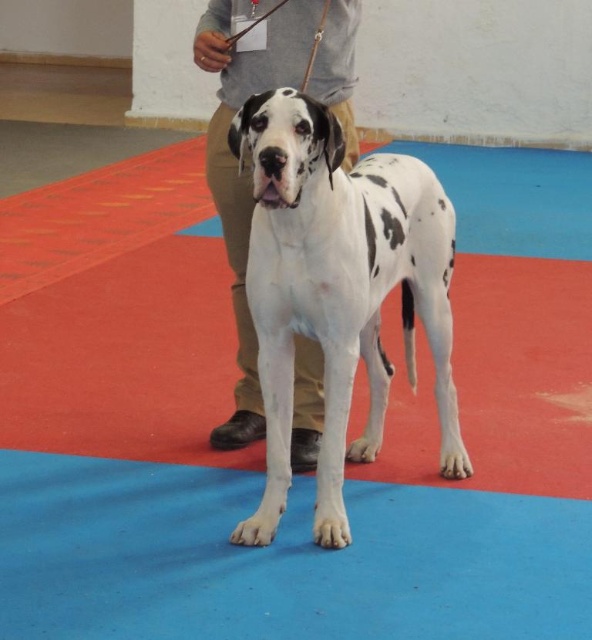
You are standing in front of the Great Dane at a dog show. A photographer asks you to move 10 feet back to give them space. If you move to the point marked at coordinates point [274,436], will you be far enough away from the Great Dane?

The point [274,436] is 7.83 feet away from the viewer, so moving there would place you only 7.83 feet away from the Great Dane, which is less than the requested 10 feet. Therefore, you need to move further back.